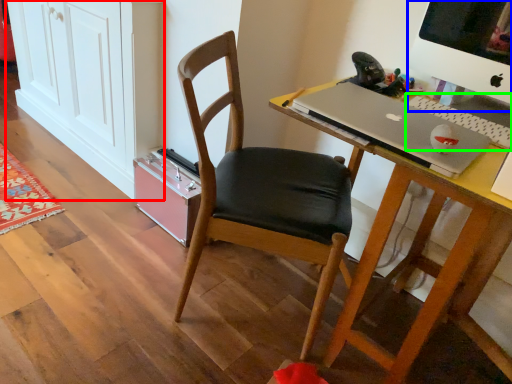
Question: Which is farther away from cabinetry (highlighted by a red box)? computer monitor (highlighted by a blue box) or laptop keyboard (highlighted by a green box)?

Choices:
 (A) computer monitor
 (B) laptop keyboard

Answer: (B)